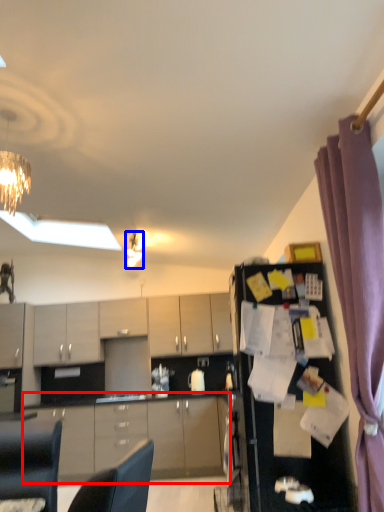
Question: Among these objects, which one is nearest to the camera, cabinetry (highlighted by a red box) or light fixture (highlighted by a blue box)?

Choices:
 (A) cabinetry
 (B) light fixture

Answer: (B)